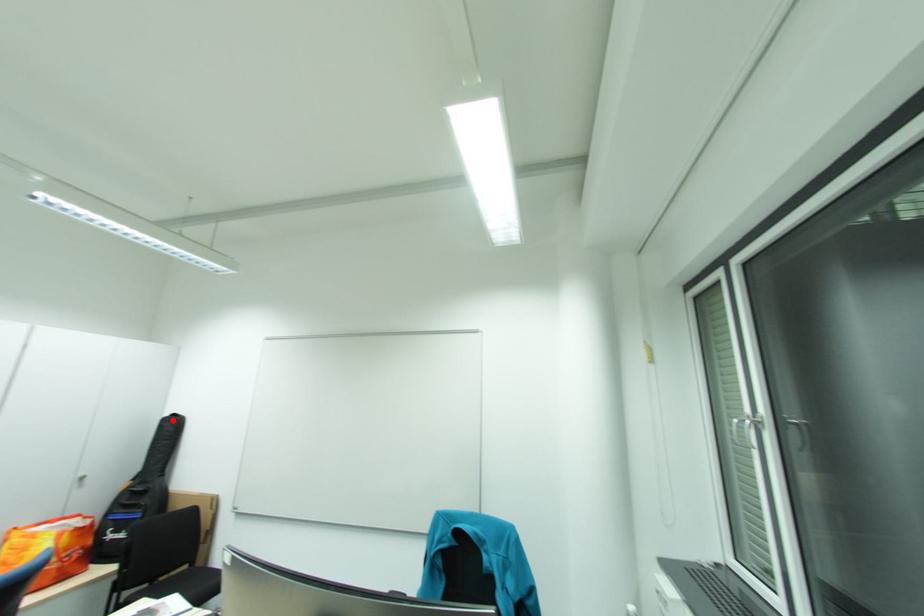
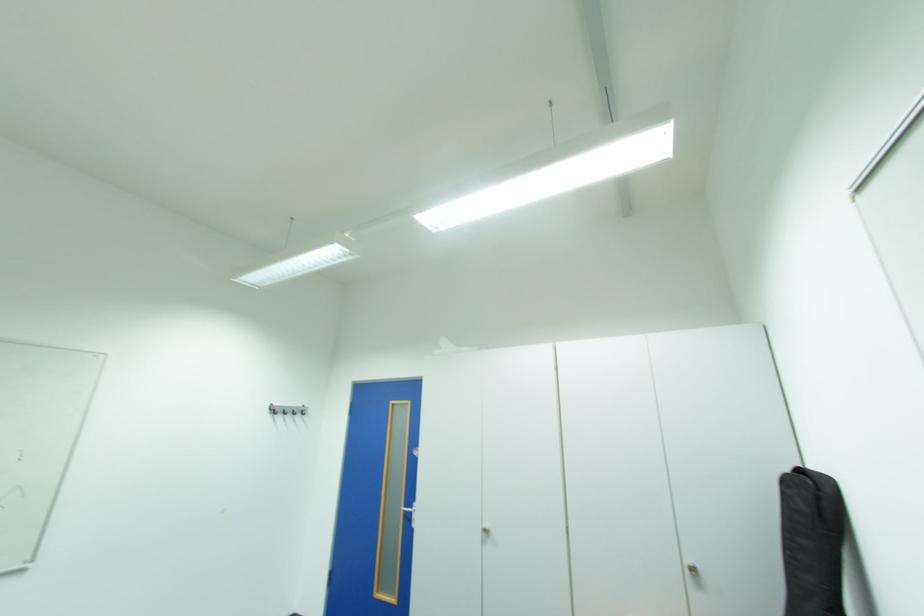
Where in the second image is the point corresponding to the highlighted location from the first image?

(795, 482)